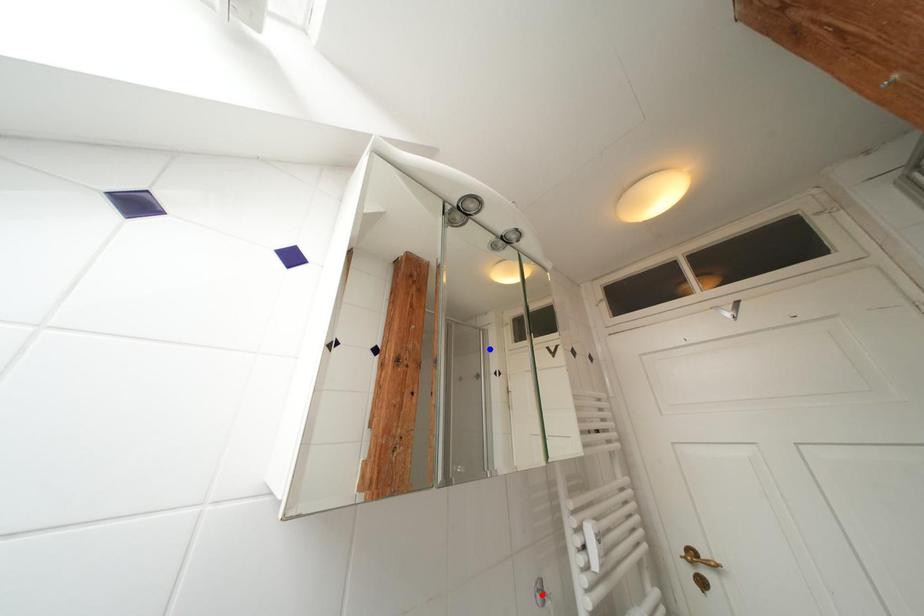
Question: In the image, two points are highlighted. Which point is nearer to the camera? Reply with the corresponding letter.

Choices:
 (A) blue point
 (B) red point

Answer: (B)